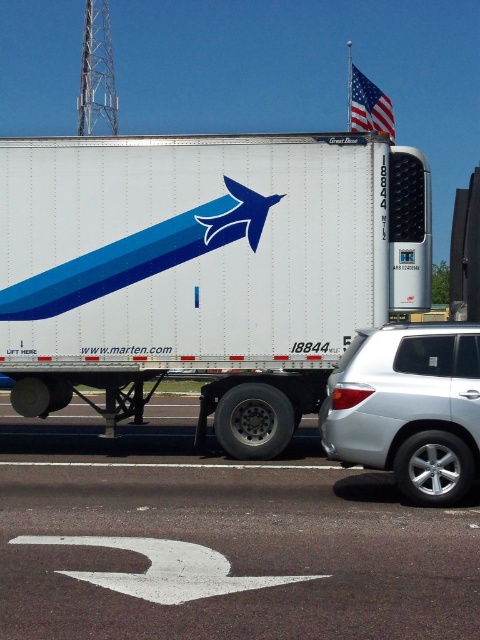
Question: Which point is farther to the camera?

Choices:
 (A) (128, 147)
 (B) (348, 502)
 (C) (388, 122)

Answer: (C)

Question: Can you confirm if white asphalt road at lower center is bigger than american flag at upper right?

Choices:
 (A) no
 (B) yes

Answer: (A)

Question: Which object appears farthest from the camera in this image?

Choices:
 (A) white matte trailer at center
 (B) silver metallic suv at right
 (C) white asphalt road at lower center
 (D) american flag at upper right

Answer: (A)

Question: Observing the image, what is the correct spatial positioning of white matte trailer at center in reference to white asphalt road at lower center?

Choices:
 (A) left
 (B) right

Answer: (A)

Question: Can you confirm if white matte trailer at center is bigger than american flag at upper right?

Choices:
 (A) no
 (B) yes

Answer: (A)

Question: Which point is farther to the camera?

Choices:
 (A) (57, 577)
 (B) (406, 372)

Answer: (B)